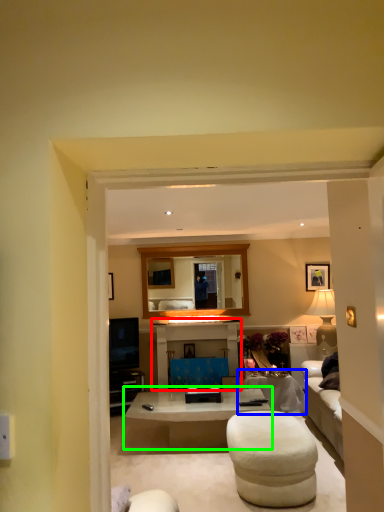
Question: Considering the real-world distances, which object is farthest from entertainment center (highlighted by a red box)? table (highlighted by a blue box) or coffee table (highlighted by a green box)?

Choices:
 (A) table
 (B) coffee table

Answer: (B)